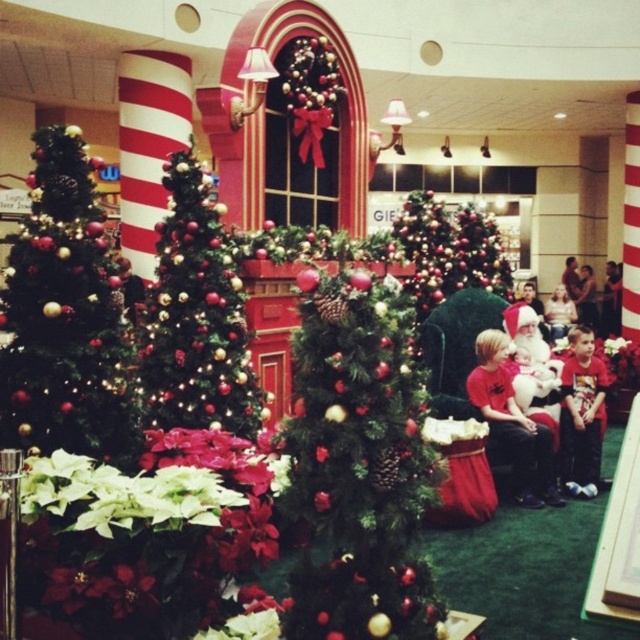
Question: Which of these objects is positioned farthest from the shiny green christmas tree at center?

Choices:
 (A) shiny gold ornaments at left
 (B) green textured christmas tree at center

Answer: (B)

Question: Among these points, which one is nearest to the camera?

Choices:
 (A) (216, 259)
 (B) (74, 253)

Answer: (B)

Question: Can you confirm if shiny gold christmas tree at center is smaller than red matte shirt at center?

Choices:
 (A) yes
 (B) no

Answer: (B)

Question: Can you confirm if green textured christmas tree at center is smaller than shiny gold christmas tree at center?

Choices:
 (A) no
 (B) yes

Answer: (B)

Question: Which point is closer to the camera taking this photo?

Choices:
 (A) (32, 288)
 (B) (428, 221)

Answer: (A)

Question: Does shiny gold ornaments at left have a lesser width compared to red matte shirt at lower right?

Choices:
 (A) yes
 (B) no

Answer: (B)